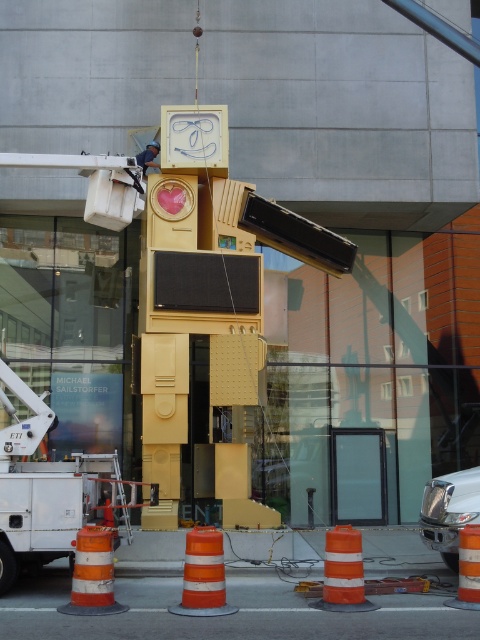
Question: Which point is closer to the camera?

Choices:
 (A) orange/white striped traffic cone at lower center
 (B) blue denim overalls at upper center

Answer: (A)

Question: Which of these objects is positioned farthest from the white metallic utility truck at lower left?

Choices:
 (A) blue denim overalls at upper center
 (B) orange/white striped traffic cone at lower center

Answer: (A)

Question: In this image, where is orange/white striped traffic cone at lower center located relative to blue denim overalls at upper center?

Choices:
 (A) left
 (B) right

Answer: (B)

Question: Is white metallic utility truck at lower left bigger than orange/white striped traffic cone at lower center?

Choices:
 (A) yes
 (B) no

Answer: (A)

Question: Does white metallic utility truck at lower left appear under orange/white striped traffic cone at lower center?

Choices:
 (A) no
 (B) yes

Answer: (A)

Question: Which is nearer to the blue denim overalls at upper center?

Choices:
 (A) orange reflective cone at lower center
 (B) orange/white striped traffic cone at lower center
 (C) white metallic utility truck at lower left

Answer: (C)